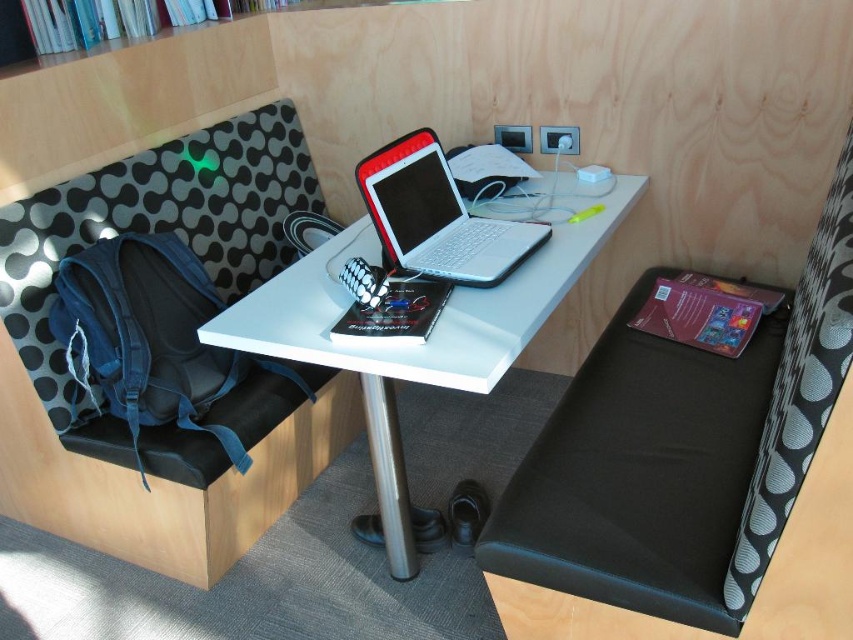
You are organizing your workspace and want to place a new decorative item on the white glossy computer desk at center. However, you need to ensure there is enough vertical space above the desk. Considering the denim backpack at left, which is taller than the desk, will the backpack obstruct the vertical space above the desk?

The denim backpack at left has a greater height compared to the white glossy computer desk at center, so the backpack will obstruct the vertical space above the desk since it is taller than the desk itself.

Please describe the position of the white glossy computer desk at center in terms of coordinates within the image frame. The image frame has its origin at the bottom left corner, with x increasing to the right and y increasing upwards. The coordinates are normalized between 0 and 1. You must use the exact object label from the Objects section in your answer.

The white glossy computer desk at center is located at coordinates approximately 0.508 on the x axis and 0.510 on the y axis within the image frame.